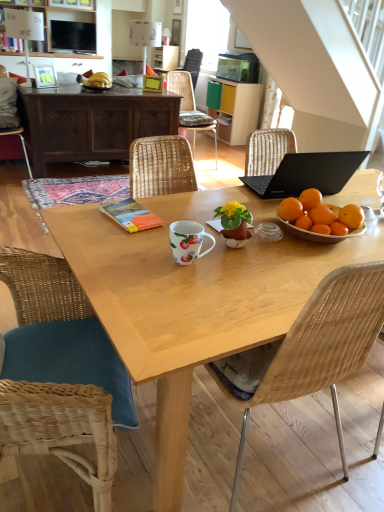
Question: Is wooden woven chair at center, acting as the first chair starting from the back, positioned beyond the bounds of wooden picture frame at upper left, which is the first picture frame from left to right?

Choices:
 (A) no
 (B) yes

Answer: (B)

Question: Does wooden woven chair at center, acting as the first chair starting from the back, touch wooden picture frame at upper left, which ranks as the first picture frame in bottom-to-top order?

Choices:
 (A) no
 (B) yes

Answer: (A)

Question: Can you confirm if wooden woven chair at center, acting as the fourth chair starting from the front, is taller than wooden picture frame at upper left, placed as the fourth picture frame when sorted from right to left?

Choices:
 (A) yes
 (B) no

Answer: (A)

Question: Is wooden picture frame at upper left, placed as the fourth picture frame when sorted from right to left, completely or partially inside wooden woven chair at center, acting as the fourth chair starting from the front?

Choices:
 (A) no
 (B) yes

Answer: (A)

Question: Is wooden woven chair at center, which appears as the second chair when viewed from the right, oriented away from wooden picture frame at upper left, which is the first picture frame from left to right?

Choices:
 (A) no
 (B) yes

Answer: (A)

Question: Is wooden picture frame at upper center, which is counted as the 4th picture frame, starting from the front, bigger or smaller than matte wood cabinet at upper left, placed as the second cabinetry when sorted from bottom to top?

Choices:
 (A) big
 (B) small

Answer: (B)

Question: From the image's perspective, is wooden picture frame at upper center, the 2th picture frame from the right, located above or below matte wood cabinet at upper left, the first cabinetry from the left?

Choices:
 (A) above
 (B) below

Answer: (A)

Question: From a real-world perspective, is wooden picture frame at upper center, which is the 2th picture frame in top-to-bottom order, above or below matte wood cabinet at upper left, placed as the second cabinetry when sorted from bottom to top?

Choices:
 (A) above
 (B) below

Answer: (A)

Question: Considering their positions, is wooden picture frame at upper center, marked as the third picture frame in a left-to-right arrangement, located in front of or behind matte wood cabinet at upper left, placed as the second cabinetry when sorted from bottom to top?

Choices:
 (A) front
 (B) behind

Answer: (B)

Question: From the image's perspective, is matte wood cabinet at upper left, placed as the second cabinetry when sorted from bottom to top, above or below matte wood cabinet at center, the 2th cabinetry from the left?

Choices:
 (A) above
 (B) below

Answer: (A)

Question: Would you say matte wood cabinet at upper left, the first cabinetry from the left, is inside or outside matte wood cabinet at center, the 2th cabinetry positioned from the top?

Choices:
 (A) outside
 (B) inside

Answer: (A)

Question: From their relative heights in the image, would you say matte wood cabinet at upper left, the 2th cabinetry from the right, is taller or shorter than matte wood cabinet at center, the first cabinetry in the bottom-to-top sequence?

Choices:
 (A) short
 (B) tall

Answer: (B)

Question: Based on their sizes in the image, would you say matte wood cabinet at upper left, the 2th cabinetry from the right, is bigger or smaller than matte wood cabinet at center, the first cabinetry in the bottom-to-top sequence?

Choices:
 (A) big
 (B) small

Answer: (A)

Question: Considering the relative positions of dark wood cabinet at upper left, the 2th desk positioned from the bottom, and matte wood cabinet at upper left, placed as the second cabinetry when sorted from bottom to top, in the image provided, is dark wood cabinet at upper left, the 2th desk positioned from the bottom, to the left or to the right of matte wood cabinet at upper left, placed as the second cabinetry when sorted from bottom to top,?

Choices:
 (A) left
 (B) right

Answer: (B)

Question: Is dark wood cabinet at upper left, which is counted as the second desk, starting from the front, bigger or smaller than matte wood cabinet at upper left, the first cabinetry from the left?

Choices:
 (A) big
 (B) small

Answer: (A)